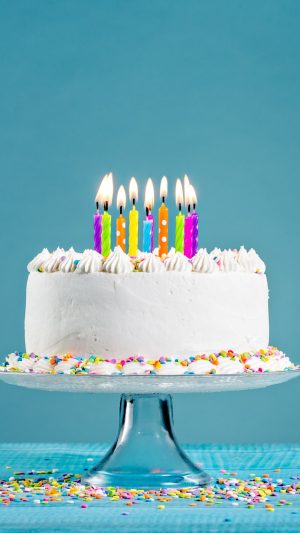
The image size is (300, 533). Find the location of `candle`. candle is located at coordinates (98, 223), (104, 226), (122, 233), (133, 229), (147, 232), (149, 218), (161, 222), (178, 226), (188, 235), (196, 224).